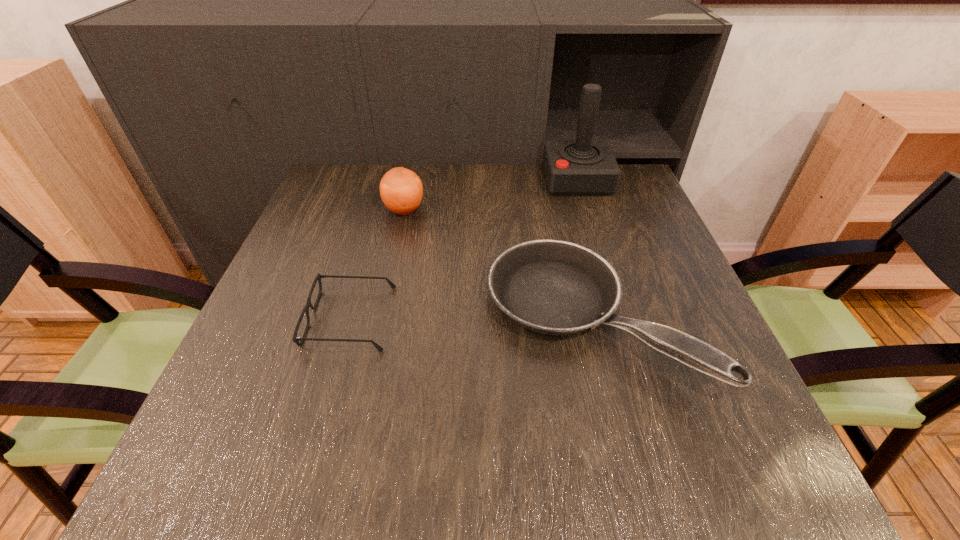
Where is `vacant space at the near edge of the desktop`? The width and height of the screenshot is (960, 540). vacant space at the near edge of the desktop is located at coordinates (519, 468).

Where is `free space at the left edge of the desktop`? This screenshot has width=960, height=540. free space at the left edge of the desktop is located at coordinates (321, 356).

This screenshot has height=540, width=960. In the image, there is a desktop. Identify the location of blank space at the right edge. (705, 395).

In the image, there is a desktop. Where is `vacant space at the far left corner`? This screenshot has width=960, height=540. vacant space at the far left corner is located at coordinates (307, 209).

In the image, there is a desktop. At what (x,y) coordinates should I click in order to perform the action: click on vacant space at the near left corner. Please return your answer as a coordinate pair (x, y). The width and height of the screenshot is (960, 540). Looking at the image, I should click on (184, 455).

Find the location of a particular element. vacant space at the far right corner is located at coordinates (643, 211).

I want to click on vacant region between the farthest object and the third nearest object, so click(491, 195).

Identify the location of empty location between the tallest object and the spectacles. (464, 249).

Where is `empty space between the third shortest object and the joystick`? The image size is (960, 540). empty space between the third shortest object and the joystick is located at coordinates (491, 195).

I want to click on unoccupied position between the shortest object and the frying pan, so click(x=470, y=319).